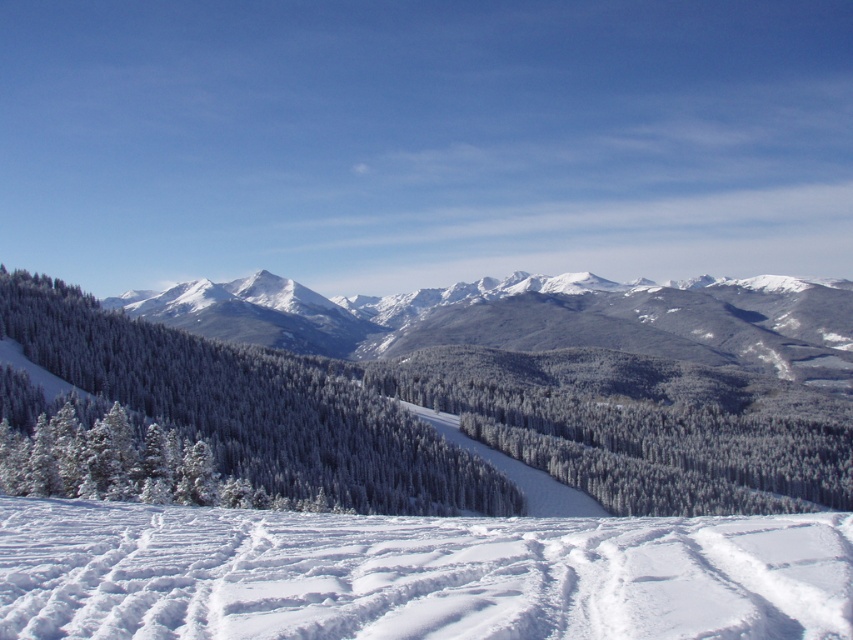
Question: Considering the real-world distances, which object is farthest from the snowy rocky mountain at center?

Choices:
 (A) white snow ski slope at lower center
 (B) white frosty trees at center

Answer: (A)

Question: Can you confirm if white snow ski slope at lower center is positioned to the left of white frosty trees at center?

Choices:
 (A) yes
 (B) no

Answer: (B)

Question: Is white snow ski slope at lower center further to the viewer compared to snowy rocky mountain at center?

Choices:
 (A) yes
 (B) no

Answer: (B)

Question: Which object is closer to the camera taking this photo?

Choices:
 (A) white frosty trees at center
 (B) snowy rocky mountain at center

Answer: (A)

Question: Which object is the farthest from the white snow ski slope at lower center?

Choices:
 (A) snowy rocky mountain at center
 (B) white frosty trees at center

Answer: (A)

Question: From the image, what is the correct spatial relationship of white snow ski slope at lower center in relation to snowy rocky mountain at center?

Choices:
 (A) below
 (B) above

Answer: (A)